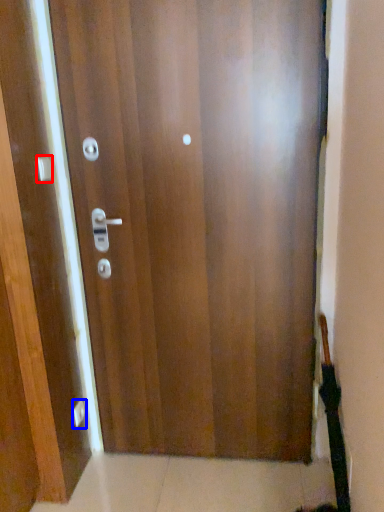
Question: Which point is further to the camera, handle (highlighted by a red box) or knob (highlighted by a blue box)?

Choices:
 (A) handle
 (B) knob

Answer: (B)